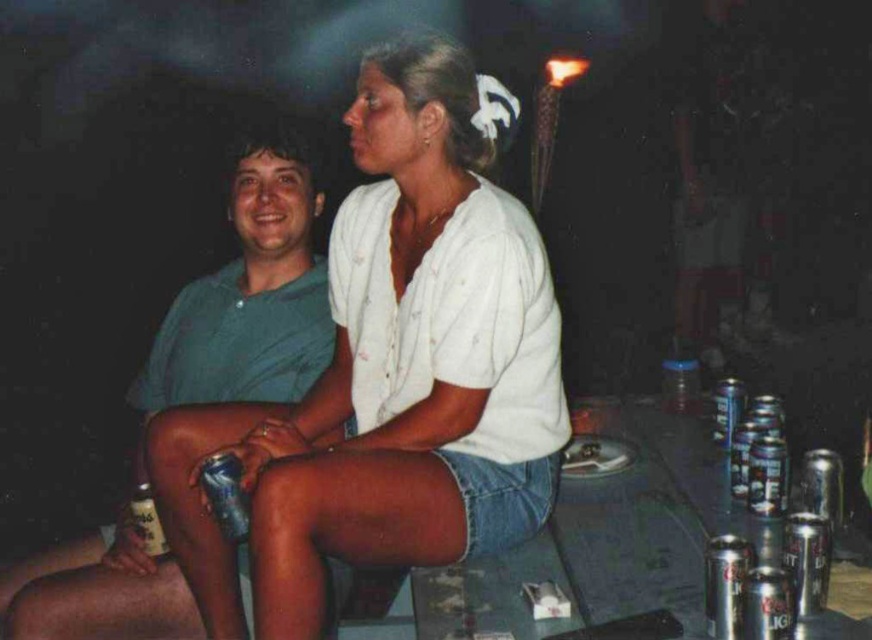
You are a photographer trying to capture a candid shot of the green matte shirt at left and the silver metallic can at lower left. If you want to ensure both subjects are in focus, which one should you prioritize focusing on first?

The green matte shirt at left should be prioritized for focus first because it is wider than the silver metallic can at lower left, ensuring a clearer overall composition.

You are a photographer adjusting your camera settings to capture the scene. You notice the green matte shirt at left and the silver metallic can at lower left. Which object should you focus on first if you want to ensure both are in sharp focus, considering their sizes?

The green matte shirt at left is taller than the silver metallic can at lower left, so focusing on the larger object first will help ensure both are in sharp focus.